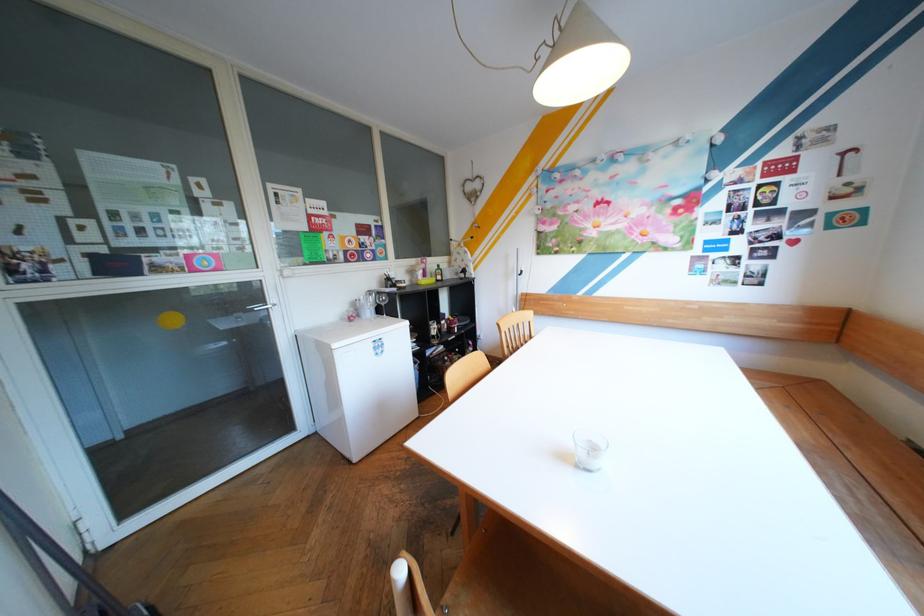
At what (x,y) coordinates should I click in order to perform the action: click on small glass cup. Please return your answer as a coordinate pair (x, y). Looking at the image, I should click on (589, 448).